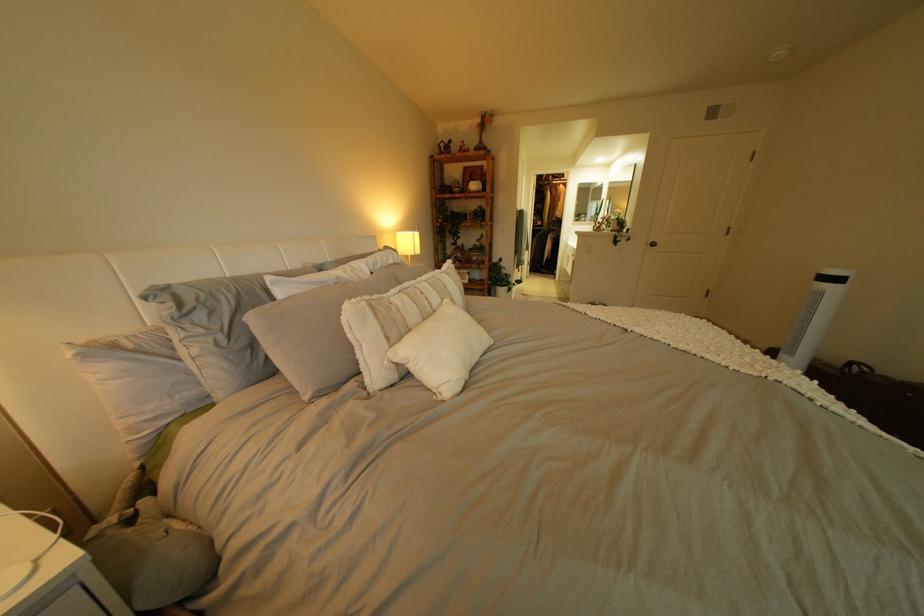
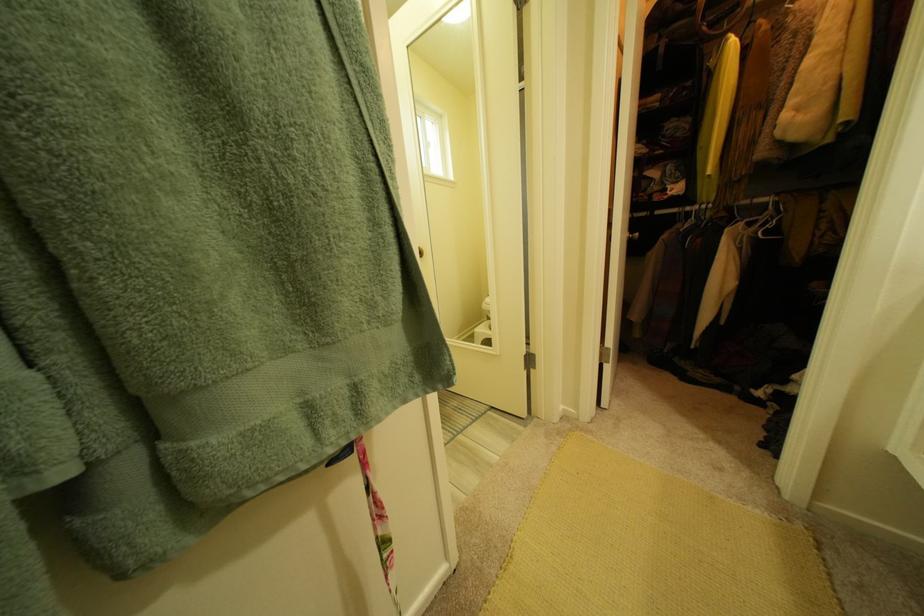
Locate, in the second image, the point that corresponds to the point at 570,229 in the first image.

(777, 201)